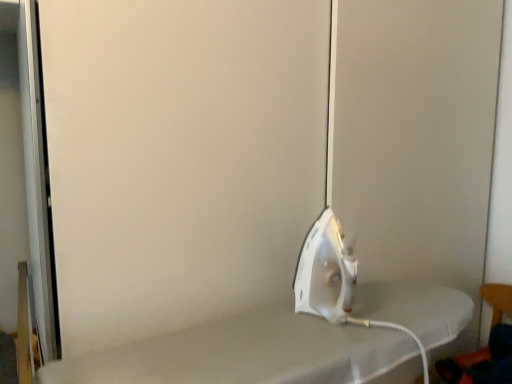
Question: Considering the positions of white glossy iron at center and wooden chair at lower right in the image, is white glossy iron at center bigger or smaller than wooden chair at lower right?

Choices:
 (A) big
 (B) small

Answer: (B)

Question: In the image, is white glossy iron at center positioned in front of or behind wooden chair at lower right?

Choices:
 (A) behind
 (B) front

Answer: (B)

Question: From the image's perspective, is white glossy iron at center positioned above or below wooden chair at lower right?

Choices:
 (A) above
 (B) below

Answer: (A)

Question: Would you say wooden chair at lower right is to the left or to the right of white glossy iron at center in the picture?

Choices:
 (A) left
 (B) right

Answer: (B)

Question: Based on their sizes in the image, would you say wooden chair at lower right is bigger or smaller than white glossy iron at center?

Choices:
 (A) big
 (B) small

Answer: (A)

Question: Is wooden chair at lower right wider or thinner than white glossy iron at center?

Choices:
 (A) wide
 (B) thin

Answer: (A)

Question: Relative to white glossy iron at center, is wooden chair at lower right in front or behind?

Choices:
 (A) front
 (B) behind

Answer: (B)